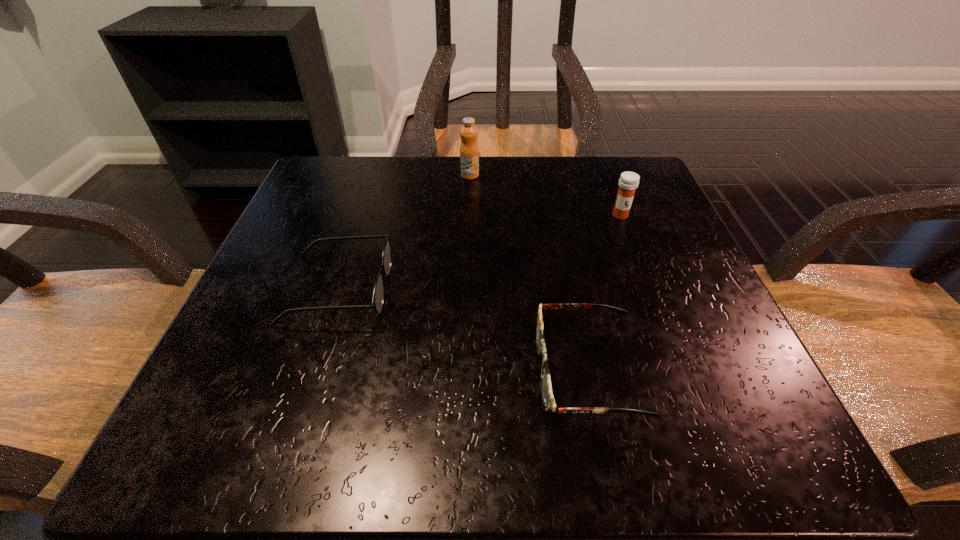
Identify the location of free space located on the frame of the right spectacles. Image resolution: width=960 pixels, height=540 pixels. (251, 371).

The width and height of the screenshot is (960, 540). I want to click on free space located 0.180m on the frame of the right spectacles, so click(x=405, y=371).

This screenshot has width=960, height=540. I want to click on orange juice present at the far edge, so click(469, 152).

Locate an element on the screen. This screenshot has height=540, width=960. medicine that is at the far edge is located at coordinates (628, 183).

The height and width of the screenshot is (540, 960). I want to click on object at the near edge, so click(549, 403).

Identify the location of object located at the left edge. (378, 295).

Where is `medicine situated at the right edge`? This screenshot has height=540, width=960. medicine situated at the right edge is located at coordinates click(628, 183).

At what (x,y) coordinates should I click in order to perform the action: click on spectacles present at the right edge. Please return your answer as a coordinate pair (x, y). Looking at the image, I should click on (549, 403).

Identify the location of object present at the far right corner. This screenshot has width=960, height=540. 628,183.

At what (x,y) coordinates should I click in order to perform the action: click on object positioned at the near right corner. Please return your answer as a coordinate pair (x, y). Looking at the image, I should click on (549, 403).